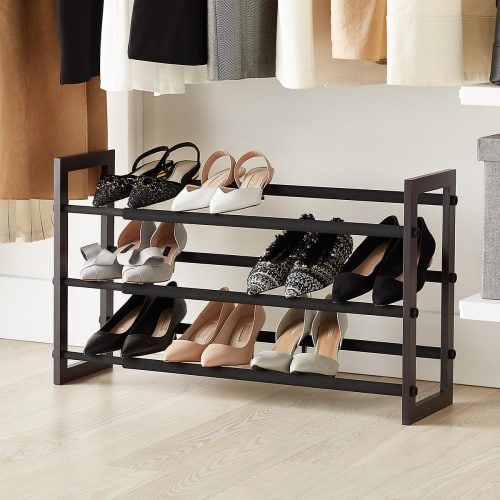
Image resolution: width=500 pixels, height=500 pixels. In order to click on shoes on bottom shelf in this screenshot , I will do `click(318, 360)`, `click(270, 355)`, `click(239, 351)`, `click(192, 345)`, `click(146, 342)`, `click(112, 345)`.